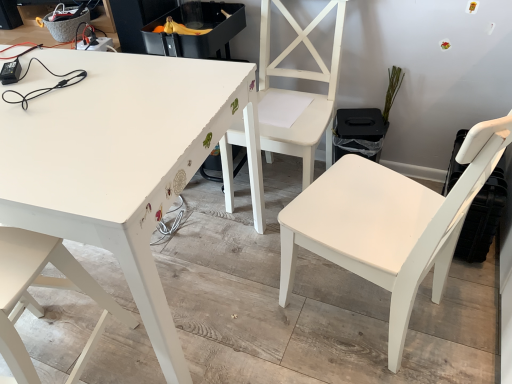
What do you see at coordinates (124, 161) in the screenshot? The image size is (512, 384). I see `white painted wood table at upper left` at bounding box center [124, 161].

At what (x,y) coordinates should I click in order to perform the action: click on white matte chair at center, arranged as the 3th chair when viewed from the left. Please return your answer as a coordinate pair (x, y). Looking at the image, I should click on (388, 224).

Describe the element at coordinates (297, 94) in the screenshot. I see `white matte chair at center, the 2th chair viewed from the right` at that location.

Identify the location of white matte chair at lower left, which is counted as the first chair, starting from the left. (36, 301).

Is white painted wood table at upper left with white matte chair at lower left, which is counted as the first chair, starting from the left?

white painted wood table at upper left is not next to white matte chair at lower left, which is counted as the first chair, starting from the left, and they're not touching.

From the image's perspective, between white painted wood table at upper left and white matte chair at lower left, which appears as the 3th chair when viewed from the right, which one is located above?

white painted wood table at upper left, from the image's perspective.

Looking at this image, how many degrees apart are the facing directions of white painted wood table at upper left and white matte chair at lower left, which appears as the 3th chair when viewed from the right?

The angle between the facing direction of white painted wood table at upper left and the facing direction of white matte chair at lower left, which appears as the 3th chair when viewed from the right, is 172 degrees.

In the scene shown: How different are the orientations of white matte chair at center, which is the 2th chair in left-to-right order, and white matte chair at center, arranged as the 3th chair when viewed from the left, in degrees?

106 degrees.

Between white matte chair at center, the 2th chair viewed from the right, and white matte chair at center, arranged as the 3th chair when viewed from the left, which one has larger size?

Bigger between the two is white matte chair at center, arranged as the 3th chair when viewed from the left.

Between white matte chair at center, which is the 2th chair in left-to-right order, and white matte chair at center, arranged as the 3th chair when viewed from the left, which one has less height?

Standing shorter between the two is white matte chair at center, arranged as the 3th chair when viewed from the left.

Is white matte chair at center, arranged as the 3th chair when viewed from the left, at the back of white matte chair at center, the 2th chair viewed from the right?

No.

Does point (270, 101) come farther from viewer compared to point (20, 369)?

Yes, point (270, 101) is behind point (20, 369).

Which object is closer to the camera taking this photo, white matte chair at center, which is the 2th chair in left-to-right order, or white matte chair at lower left, which appears as the 3th chair when viewed from the right?

white matte chair at lower left, which appears as the 3th chair when viewed from the right.

Is white matte chair at center, the 2th chair viewed from the right, thinner than white matte chair at lower left, which is counted as the first chair, starting from the left?

No.

In the scene shown: Is white matte chair at center, the 2th chair viewed from the right, not close to white matte chair at lower left, which appears as the 3th chair when viewed from the right?

No.

From the image's perspective, which one is positioned higher, white matte chair at center, the first chair positioned from the right, or white matte chair at lower left, which is counted as the first chair, starting from the left?

white matte chair at center, the first chair positioned from the right, appears higher in the image.

Does white matte chair at center, the first chair positioned from the right, contain white matte chair at lower left, which appears as the 3th chair when viewed from the right?

No, white matte chair at center, the first chair positioned from the right, does not contain white matte chair at lower left, which appears as the 3th chair when viewed from the right.

Could you tell me if white matte chair at center, arranged as the 3th chair when viewed from the left, is facing white matte chair at lower left, which is counted as the first chair, starting from the left?

No, white matte chair at center, arranged as the 3th chair when viewed from the left, is not aimed at white matte chair at lower left, which is counted as the first chair, starting from the left.

Could you measure the distance between white matte chair at lower left, which appears as the 3th chair when viewed from the right, and white matte chair at center, the first chair positioned from the right?

white matte chair at lower left, which appears as the 3th chair when viewed from the right, and white matte chair at center, the first chair positioned from the right, are 31.88 inches apart.

Is white matte chair at lower left, which is counted as the first chair, starting from the left, looking in the opposite direction of white matte chair at center, the first chair positioned from the right?

That's not correct — white matte chair at lower left, which is counted as the first chair, starting from the left, is not looking away from white matte chair at center, the first chair positioned from the right.

From the image's perspective, would you say white matte chair at lower left, which appears as the 3th chair when viewed from the right, is positioned over white matte chair at center, arranged as the 3th chair when viewed from the left?

No, from the image's perspective, white matte chair at lower left, which appears as the 3th chair when viewed from the right, is not above white matte chair at center, arranged as the 3th chair when viewed from the left.

Is white matte chair at lower left, which is counted as the first chair, starting from the left, further to the viewer compared to white matte chair at center, arranged as the 3th chair when viewed from the left?

Yes, it is.

Which of these two, white matte chair at center, arranged as the 3th chair when viewed from the left, or white painted wood table at upper left, is bigger?

Bigger between the two is white painted wood table at upper left.

From the image's perspective, is white matte chair at center, the first chair positioned from the right, beneath white painted wood table at upper left?

Yes, from the image's perspective, white matte chair at center, the first chair positioned from the right, is below white painted wood table at upper left.

From a real-world perspective, is white matte chair at center, arranged as the 3th chair when viewed from the left, beneath white painted wood table at upper left?

Incorrect, from a real-world perspective, white matte chair at center, arranged as the 3th chair when viewed from the left, is higher than white painted wood table at upper left.

Is white matte chair at center, which is the 2th chair in left-to-right order, inside or outside of white painted wood table at upper left?

white matte chair at center, which is the 2th chair in left-to-right order, is spatially situated outside white painted wood table at upper left.

This screenshot has width=512, height=384. In order to click on table lying in front of the white matte chair at center, which is the 2th chair in left-to-right order in this screenshot , I will do `click(124, 161)`.

Considering the points (321, 116) and (103, 193), which point is behind, point (321, 116) or point (103, 193)?

The point (321, 116) is more distant.

Considering the positions of objects white matte chair at center, which is the 2th chair in left-to-right order, and white painted wood table at upper left in the image provided, who is more to the left, white matte chair at center, which is the 2th chair in left-to-right order, or white painted wood table at upper left?

white painted wood table at upper left is more to the left.

Locate an element on the screen. table on the right of white matte chair at lower left, which appears as the 3th chair when viewed from the right is located at coordinates (124, 161).

From the white matte chair at center, arranged as the 3th chair when viewed from the left, count the 1st chair to the left and point to it. Please provide its 2D coordinates.

[(297, 94)]

When comparing their distances from white matte chair at center, the first chair positioned from the right, does white painted wood table at upper left or white matte chair at lower left, which appears as the 3th chair when viewed from the right, seem closer?

white painted wood table at upper left.

Looking at the image, which one is located further to white painted wood table at upper left, white matte chair at center, the first chair positioned from the right, or white matte chair at lower left, which is counted as the first chair, starting from the left?

white matte chair at center, the first chair positioned from the right.

From the image, which object appears to be farther from white painted wood table at upper left, white matte chair at lower left, which is counted as the first chair, starting from the left, or white matte chair at center, the 2th chair viewed from the right?

white matte chair at center, the 2th chair viewed from the right, is further to white painted wood table at upper left.

Looking at the image, which one is located further to white matte chair at lower left, which appears as the 3th chair when viewed from the right, white matte chair at center, the 2th chair viewed from the right, or white matte chair at center, arranged as the 3th chair when viewed from the left?

Based on the image, white matte chair at center, the 2th chair viewed from the right, appears to be further to white matte chair at lower left, which appears as the 3th chair when viewed from the right.

Consider the image. Estimate the real-world distances between objects in this image. Which object is further from white matte chair at center, the 2th chair viewed from the right, white painted wood table at upper left or white matte chair at lower left, which appears as the 3th chair when viewed from the right?

Among the two, white matte chair at lower left, which appears as the 3th chair when viewed from the right, is located further to white matte chair at center, the 2th chair viewed from the right.

When comparing their distances from white matte chair at center, arranged as the 3th chair when viewed from the left, does white painted wood table at upper left or white matte chair at center, the 2th chair viewed from the right, seem closer?

Based on the image, white matte chair at center, the 2th chair viewed from the right, appears to be nearer to white matte chair at center, arranged as the 3th chair when viewed from the left.

Based on their spatial positions, is white matte chair at lower left, which appears as the 3th chair when viewed from the right, or white matte chair at center, arranged as the 3th chair when viewed from the left, further from white painted wood table at upper left?

Among the two, white matte chair at center, arranged as the 3th chair when viewed from the left, is located further to white painted wood table at upper left.

Considering their positions, is white matte chair at center, the 2th chair viewed from the right, positioned closer to white matte chair at center, the first chair positioned from the right, than white painted wood table at upper left?

white matte chair at center, the 2th chair viewed from the right.

Find the location of a particular element. chair between white matte chair at lower left, which is counted as the first chair, starting from the left, and white matte chair at center, the first chair positioned from the right is located at coordinates (297, 94).

Where is `chair situated between white painted wood table at upper left and white matte chair at center, the first chair positioned from the right, from left to right`? The width and height of the screenshot is (512, 384). chair situated between white painted wood table at upper left and white matte chair at center, the first chair positioned from the right, from left to right is located at coordinates (297, 94).

Where is `table located between white matte chair at lower left, which is counted as the first chair, starting from the left, and white matte chair at center, the 2th chair viewed from the right, in the left-right direction`? Image resolution: width=512 pixels, height=384 pixels. table located between white matte chair at lower left, which is counted as the first chair, starting from the left, and white matte chair at center, the 2th chair viewed from the right, in the left-right direction is located at coordinates (124, 161).

Where is `table between white matte chair at lower left, which appears as the 3th chair when viewed from the right, and white matte chair at center, the first chair positioned from the right`? table between white matte chair at lower left, which appears as the 3th chair when viewed from the right, and white matte chair at center, the first chair positioned from the right is located at coordinates (124, 161).